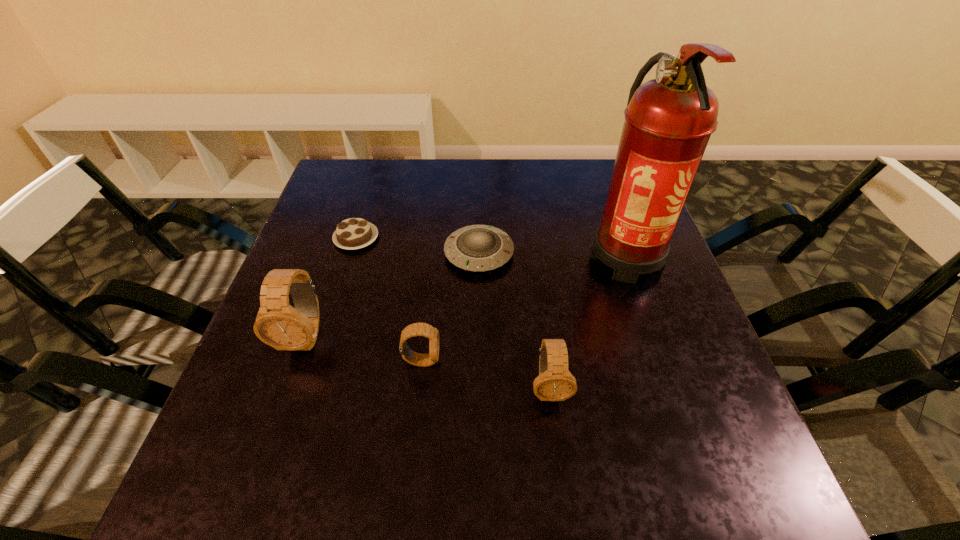
At what (x,y) coordinates should I click in order to perform the action: click on the second tallest object. Please return your answer as a coordinate pair (x, y). This screenshot has height=540, width=960. Looking at the image, I should click on (279, 325).

Identify the location of the leftmost watch. (x=279, y=325).

Where is `the second watch from left to right`? the second watch from left to right is located at coordinates (416, 329).

Locate an element on the screen. Image resolution: width=960 pixels, height=540 pixels. the third shortest object is located at coordinates (416, 329).

At what (x,y) coordinates should I click in order to perform the action: click on the second tallest watch. Please return your answer as a coordinate pair (x, y). Image resolution: width=960 pixels, height=540 pixels. Looking at the image, I should click on (555, 382).

Find the location of a particular element. This screenshot has height=540, width=960. the third tallest object is located at coordinates (555, 382).

Locate an element on the screen. The width and height of the screenshot is (960, 540). the rightmost object is located at coordinates (669, 120).

Identify the location of fire extinguisher. (669, 120).

The height and width of the screenshot is (540, 960). What are the coordinates of `saucer` in the screenshot? It's located at (478, 248).

Find the location of `the shortest object`. the shortest object is located at coordinates (354, 233).